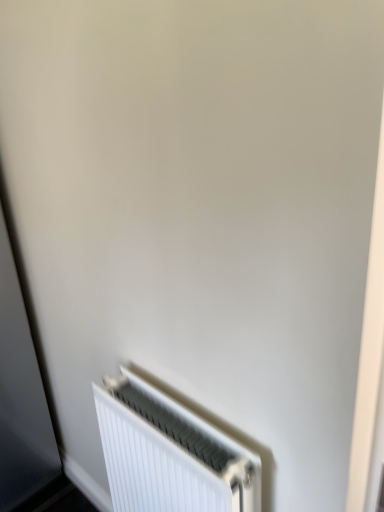
This screenshot has height=512, width=384. Identify the location of white plastic radiator at lower right. (169, 454).

Image resolution: width=384 pixels, height=512 pixels. What do you see at coordinates (169, 454) in the screenshot?
I see `white plastic radiator at lower right` at bounding box center [169, 454].

Where is `white plastic radiator at lower right`? white plastic radiator at lower right is located at coordinates (169, 454).